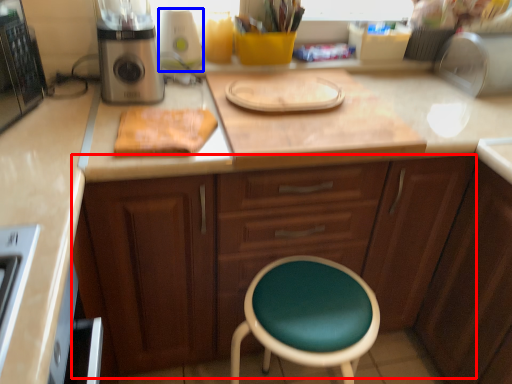
Question: Which point is further to the camera, cabinetry (highlighted by a red box) or appliance (highlighted by a blue box)?

Choices:
 (A) cabinetry
 (B) appliance

Answer: (B)